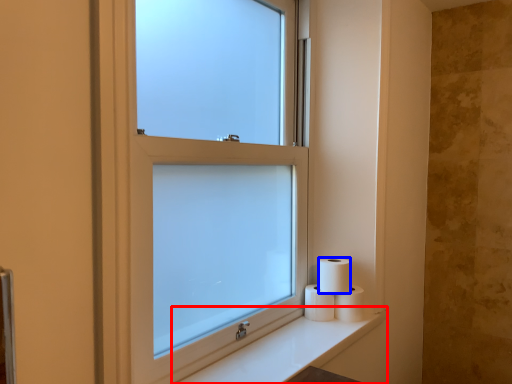
Question: Which object is closer to the camera taking this photo, counter top (highlighted by a red box) or toilet paper (highlighted by a blue box)?

Choices:
 (A) counter top
 (B) toilet paper

Answer: (A)